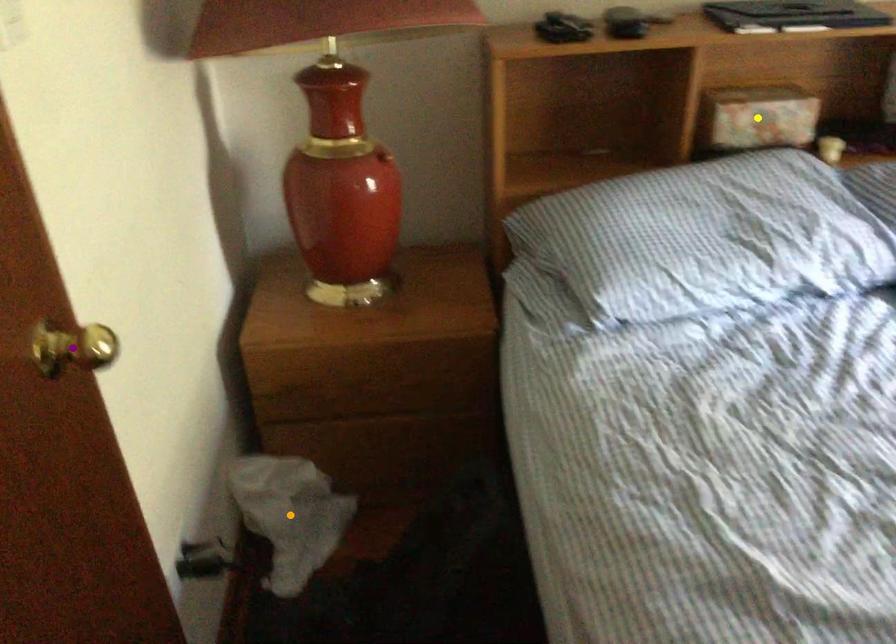
Order these from nearest to farthest:
purple point, orange point, yellow point

yellow point
orange point
purple point